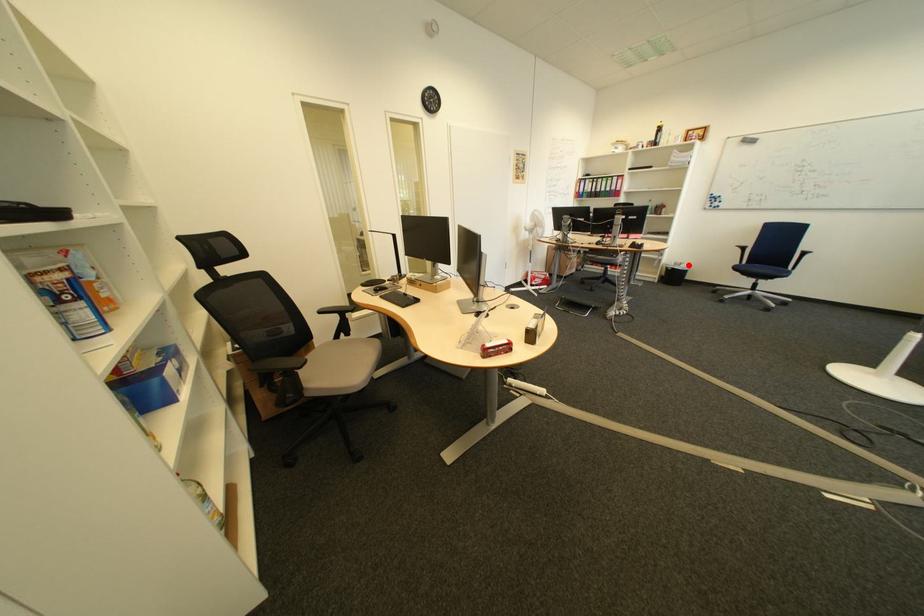
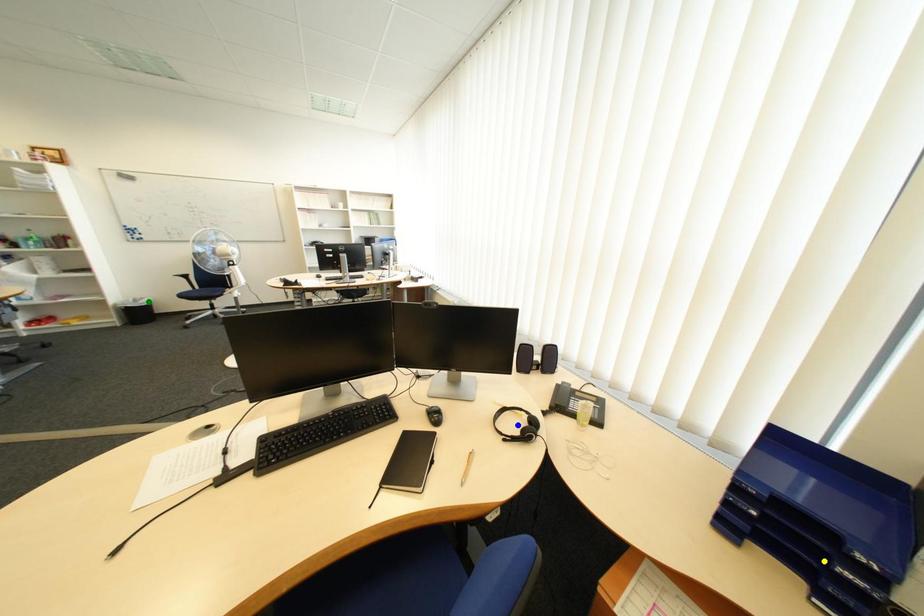
Question: I am providing you with two images of the same scene from different viewpoints. A red point is marked on the first image. You are given multiple points on the second image. Which point in image 2 represents the same 3d spot as the red point in image 1?

Choices:
 (A) green point
 (B) blue point
 (C) yellow point

Answer: (A)